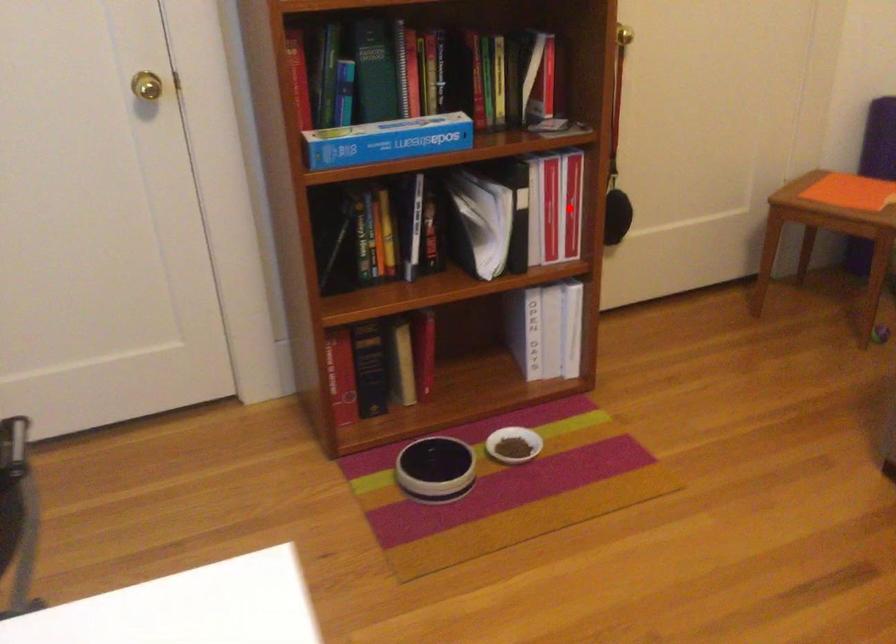
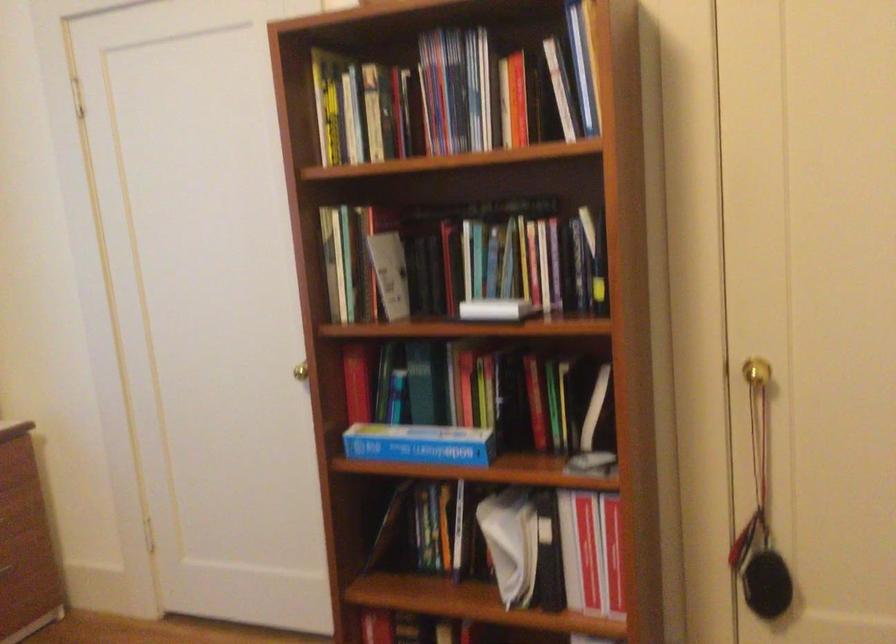
Find the pixel in the second image that matches the highlighted location in the first image.

(613, 554)